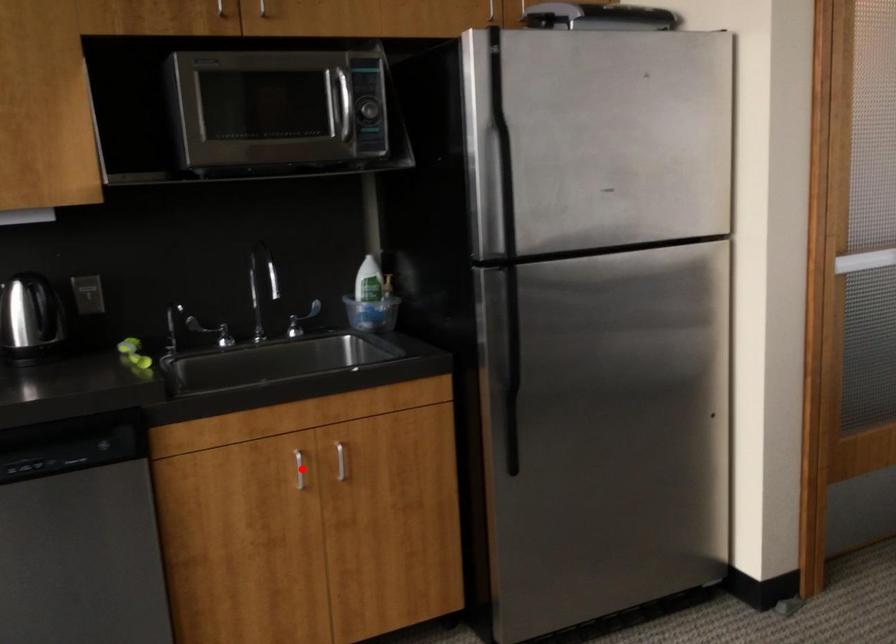
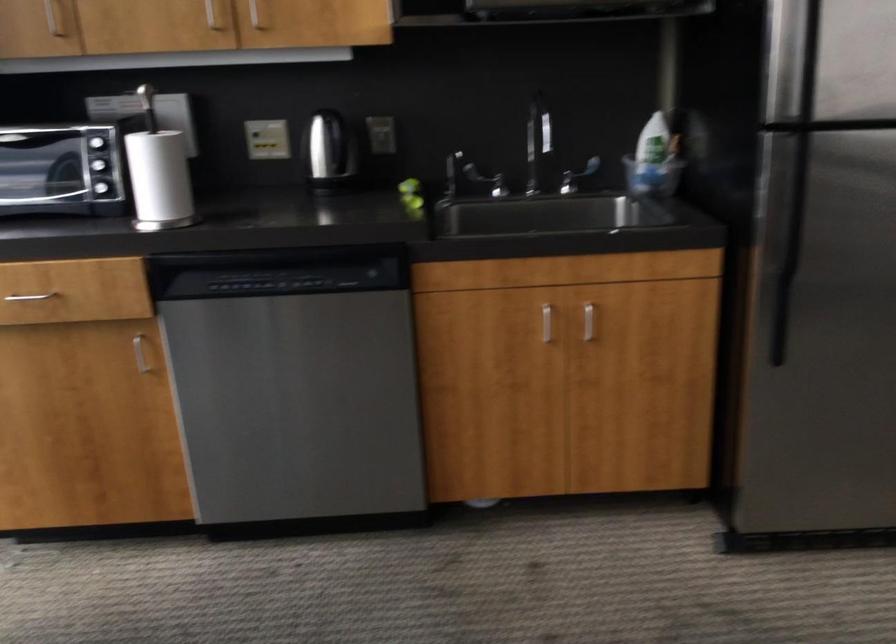
In the second image, find the point that corresponds to the highlighted location in the first image.

(546, 323)